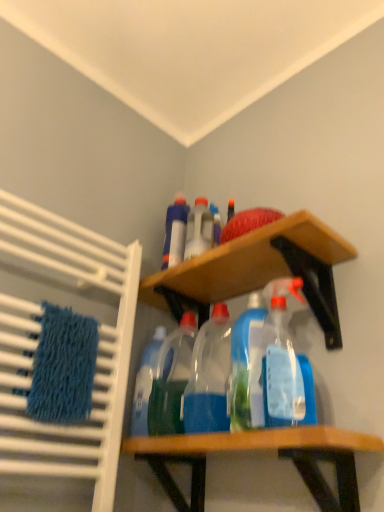
Question: From a real-world perspective, is transparent plastic spray bottle at center, the 2th cleaning product viewed from the left, above or below transparent plastic bottles at center, which appears as the first bottle when viewed from the front?

Choices:
 (A) above
 (B) below

Answer: (A)

Question: From the image's perspective, relative to transparent plastic bottles at center, positioned as the fourth bottle in back-to-front order, is transparent plastic spray bottle at center, the first cleaning product when ordered from right to left, above or below?

Choices:
 (A) below
 (B) above

Answer: (B)

Question: Based on their relative distances, which object is nearer to the wooden shelf at upper center, the second shelf from the bottom?

Choices:
 (A) blue textured bath towel at left
 (B) translucent plastic spray bottle at center, the 3th bottle when ordered from front to back
 (C) transparent plastic bottles at center, positioned as the fourth bottle in back-to-front order
 (D) wooden shelf at center, acting as the 2th shelf starting from the top
 (E) translucent plastic spray bottle at upper center, placed as the fourth bottle when sorted from front to back

Answer: (B)

Question: Which is farther from the translucent plastic spray bottle at center, the second bottle from the back?

Choices:
 (A) translucent plastic spray bottle at upper center, placed as the first bottle when sorted from back to front
 (B) transparent plastic bottles at center, positioned as the fourth bottle in back-to-front order
 (C) translucent plastic bottle at center, positioned as the third bottle in back-to-front order
 (D) translucent plastic spray bottle at center, placed as the second cleaning product when sorted from right to left
 (E) wooden shelf at center, the first shelf positioned from the bottom

Answer: (E)